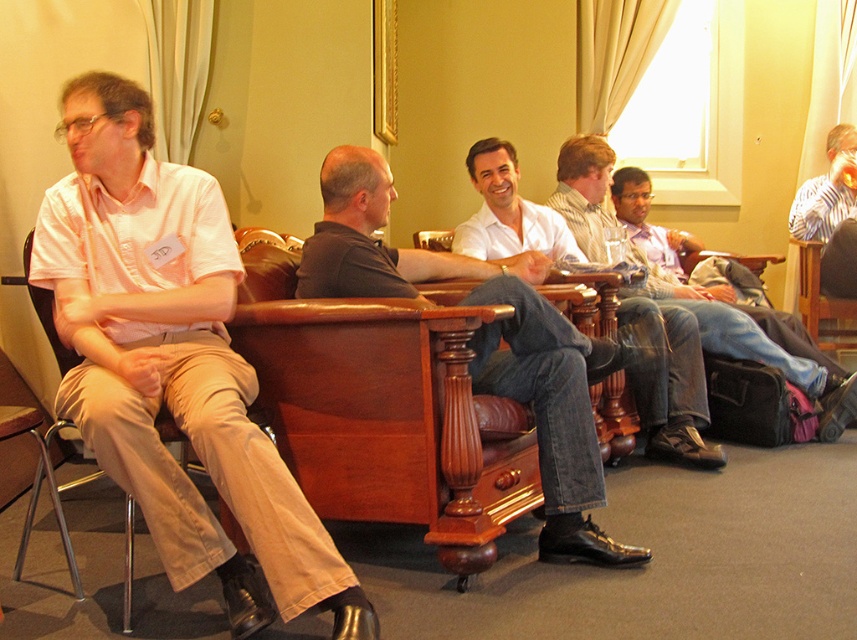
Looking at this image, you are a photographer setting up for a group photo. You notice two key subjects in the scene, the denim jeans at center and the striped shirt at upper right. To ensure both are framed properly, which subject should you position on the left side of the photo?

The denim jeans at center should be positioned on the left side of the photo since it is already to the left of the striped shirt at upper right in the scene.

You are standing at the origin of the room and want to move to the point labeled point (130, 509). There is an obstacle at point (589, 216). Will you encounter this obstacle before reaching your destination?

Point (589, 216) is behind point (130, 509), so you will not encounter the obstacle at point (589, 216) before reaching your destination.